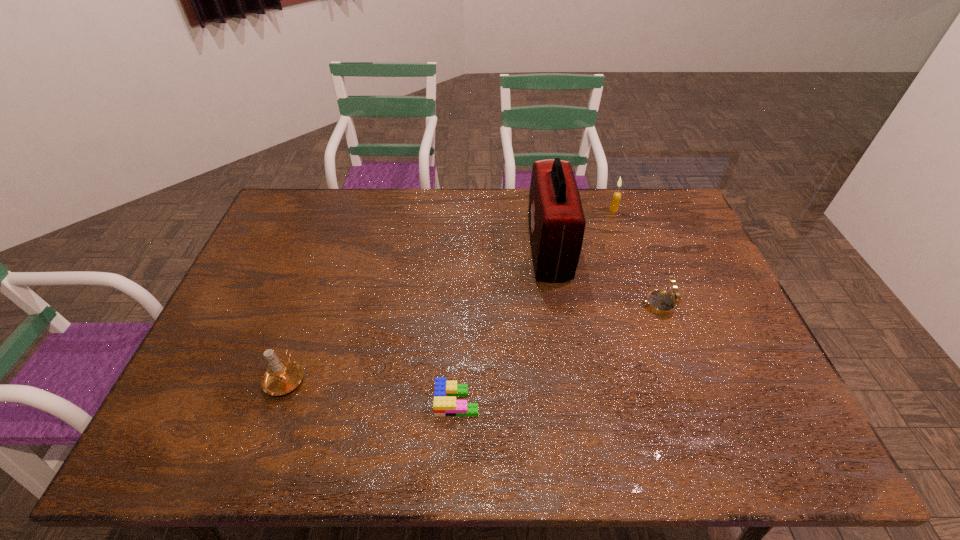
Locate an element on the screen. The width and height of the screenshot is (960, 540). vacant space that's between the Lego and the fourth tallest object is located at coordinates (558, 353).

Identify the location of free point between the third nearest object and the left candle. This screenshot has height=540, width=960. (472, 341).

At what (x,y) coordinates should I click in order to perform the action: click on blank region between the fourth nearest object and the Lego. Please return your answer as a coordinate pair (x, y). Looking at the image, I should click on (503, 326).

What are the coordinates of `vacant space in between the farther candle and the nearer candle` in the screenshot? It's located at (449, 293).

At what (x,y) coordinates should I click in order to perform the action: click on free space between the second farthest object and the second shortest object. Please return your answer as a coordinate pair (x, y). The height and width of the screenshot is (540, 960). Looking at the image, I should click on (603, 277).

This screenshot has width=960, height=540. I want to click on free space between the second shortest object and the shortest object, so click(x=558, y=353).

This screenshot has width=960, height=540. I want to click on free area in between the farthest object and the leftmost object, so click(449, 293).

Identify which object is the fourth nearest to the right candle. Please provide its 2D coordinates. Your answer should be formatted as a tuple, i.e. [(x, y)], where the tuple contains the x and y coordinates of a point satisfying the conditions above.

[(281, 377)]

Select which object is the third closest to the leftmost object. Please provide its 2D coordinates. Your answer should be formatted as a tuple, i.e. [(x, y)], where the tuple contains the x and y coordinates of a point satisfying the conditions above.

[(660, 302)]